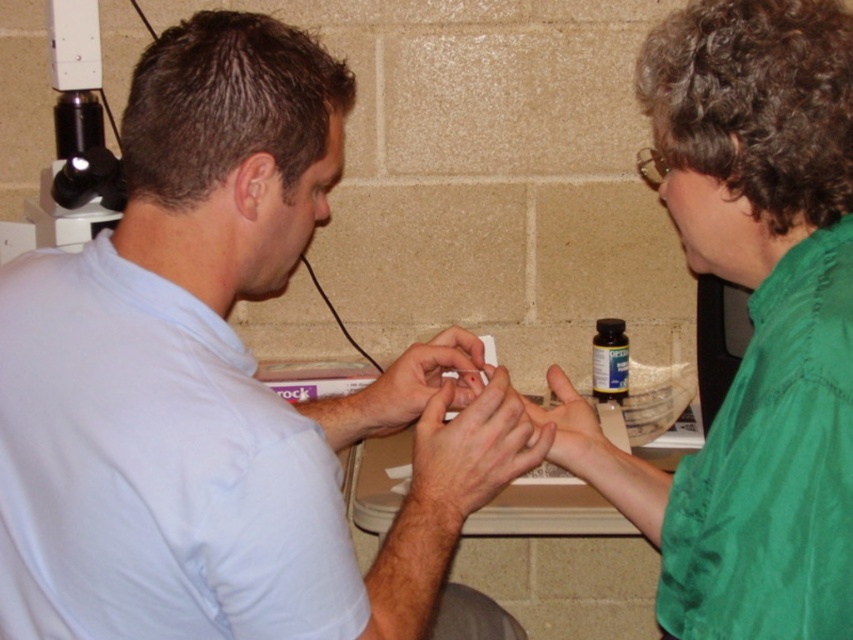
You are a medical student observing a blood draw procedure. You notice two objects at the center of your view. One is labeled as smooth skin at center and the other as matte white hands at center. Based on their sizes, which object is more likely to belong to the patient?

The smooth skin at center has a larger size compared to matte white hands at center, so the smooth skin at center is more likely to belong to the patient since patients typically have their skin exposed during procedures like blood draws, and the larger size might indicate the area where the procedure is being performed.

You are a medical student observing a blood draw procedure. You see the matte white hands at center and the green matte hand at center. Which hand is positioned higher above the other?

The matte white hands at center are positioned above the green matte hand at center.

You are a healthcare professional observing a medical procedure. You notice the light blue shirt at center and the smooth skin at center. Which object is closer to the viewer?

The light blue shirt at center is positioned over smooth skin at center, so the light blue shirt at center is closer to the viewer.